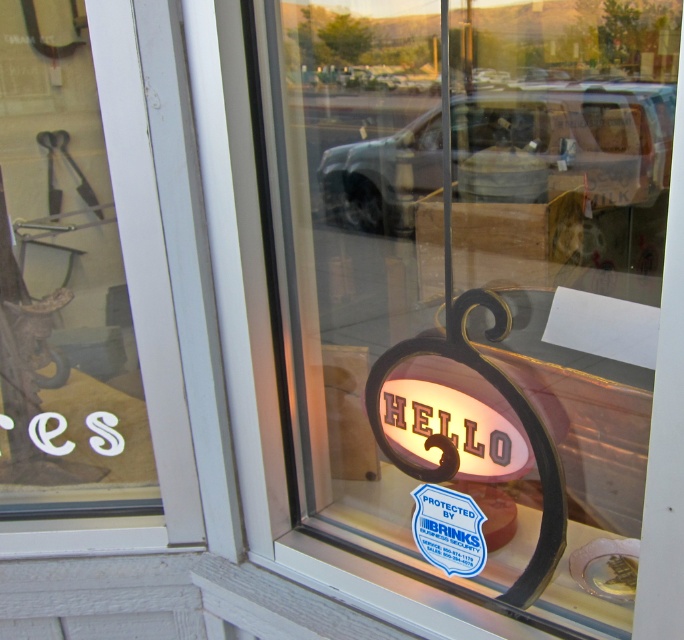
Can you confirm if matte glass sign at center is bigger than white frosted glass at left?

Yes.

Is point (345, 312) closer to viewer compared to point (131, 209)?

No, it is not.

Identify the location of matte glass sign at center. (473, 276).